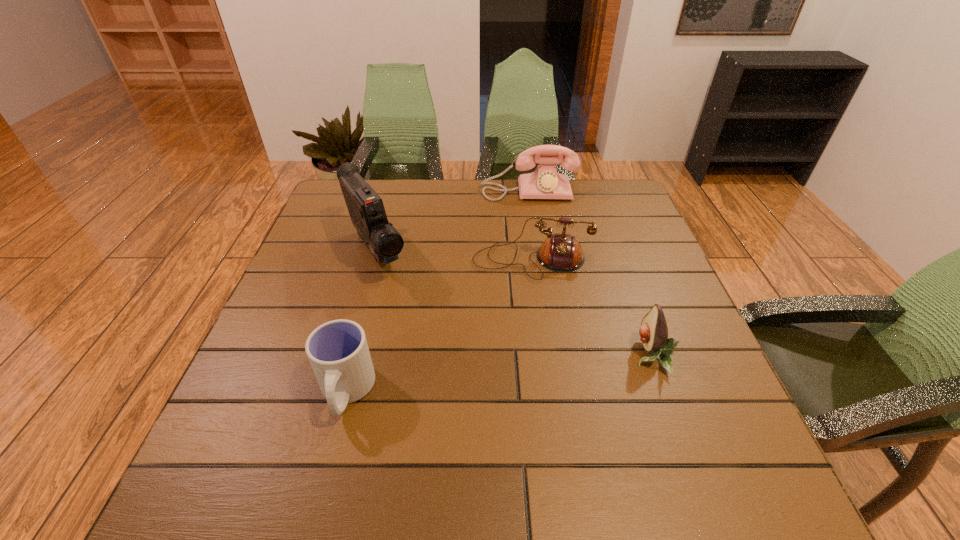
The height and width of the screenshot is (540, 960). In order to click on object that is at the near edge in this screenshot , I will do `click(338, 352)`.

Identify the location of cup that is at the left edge. (338, 352).

The width and height of the screenshot is (960, 540). Identify the location of camcorder present at the left edge. (366, 209).

Locate an element on the screen. The width and height of the screenshot is (960, 540). object located in the right edge section of the desktop is located at coordinates (654, 332).

Where is `object that is at the far left corner`? object that is at the far left corner is located at coordinates (366, 209).

Image resolution: width=960 pixels, height=540 pixels. What are the coordinates of `object positioned at the near left corner` in the screenshot? It's located at (338, 352).

This screenshot has height=540, width=960. Identify the location of blank space at the far edge of the desktop. (455, 206).

Identify the location of vacant region at the near edge of the desktop. (556, 421).

In the image, there is a desktop. What are the coordinates of `vacant region at the left edge` in the screenshot? It's located at (295, 376).

Locate an element on the screen. vacant space at the right edge is located at coordinates (646, 224).